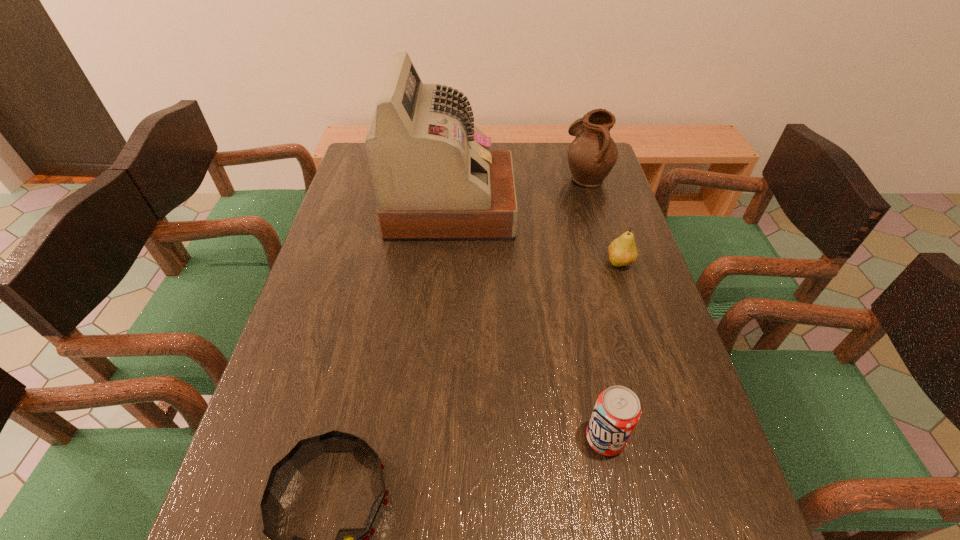
This screenshot has width=960, height=540. Identify the location of free space located 0.110m on the front of the shortest object. (633, 305).

Locate an element on the screen. This screenshot has width=960, height=540. cash register that is at the far edge is located at coordinates (435, 178).

Locate an element on the screen. pitcher at the far edge is located at coordinates (592, 154).

The width and height of the screenshot is (960, 540). In order to click on object located in the left edge section of the desktop in this screenshot , I will do `click(435, 178)`.

At what (x,y) coordinates should I click in order to perform the action: click on pitcher at the right edge. Please return your answer as a coordinate pair (x, y). Image resolution: width=960 pixels, height=540 pixels. Looking at the image, I should click on (592, 154).

Locate an element on the screen. The image size is (960, 540). pear present at the right edge is located at coordinates (622, 252).

Where is `object that is at the far left corner`? This screenshot has height=540, width=960. object that is at the far left corner is located at coordinates (435, 178).

Locate an element on the screen. The width and height of the screenshot is (960, 540). object that is at the far right corner is located at coordinates (592, 154).

You are a GUI agent. You are given a task and a screenshot of the screen. Output one action in this format:
    pyautogui.click(x=<x>, y=<y>)
    Task: Click on the free region at the far edge
    The width and height of the screenshot is (960, 540).
    Given the screenshot: What is the action you would take?
    pyautogui.click(x=528, y=177)

Identify the location of vacant area at the left edge of the desktop. (325, 358).